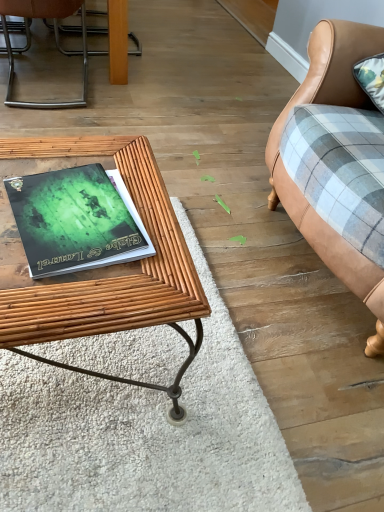
Identify the location of space that is in front of green matte book at center. Image resolution: width=384 pixels, height=512 pixels. (72, 297).